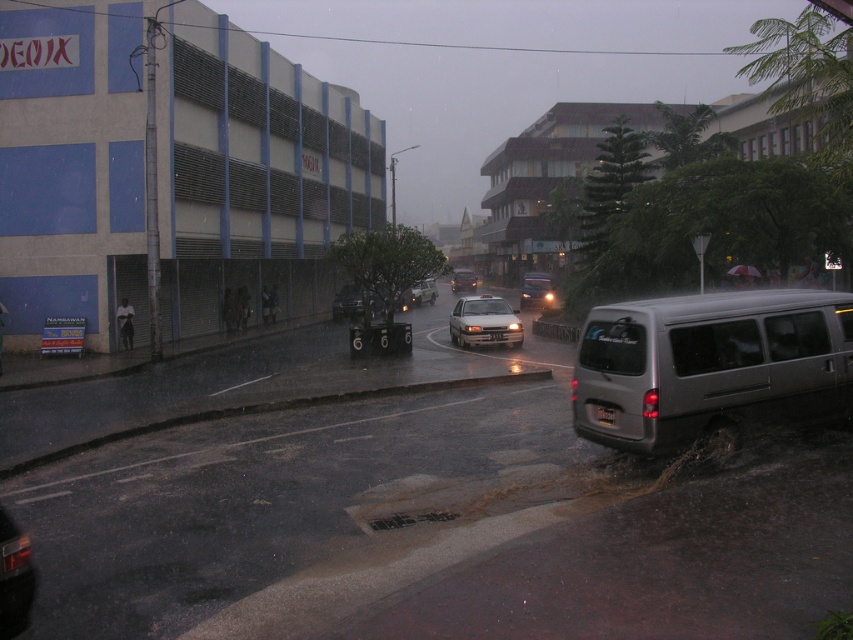
Measure the distance between satin silver van at lower right and camera.

satin silver van at lower right and camera are 8.39 meters apart from each other.

Is satin silver van at lower right wider than metallic silver van at center?

In fact, satin silver van at lower right might be narrower than metallic silver van at center.

Measure the distance between satin silver van at lower right and camera.

satin silver van at lower right is 8.39 meters from camera.

You are a GUI agent. You are given a task and a screenshot of the screen. Output one action in this format:
    pyautogui.click(x=<x>, y=<y>)
    Task: Click on the satin silver van at lower right
    The image size is (853, 640).
    Given the screenshot: What is the action you would take?
    pos(711,364)

What do you see at coordinates (485, 323) in the screenshot?
I see `white matte sedan at center` at bounding box center [485, 323].

Which is in front, point (477, 326) or point (410, 300)?

Point (477, 326) is in front.

Which is behind, point (474, 324) or point (421, 298)?

The point (421, 298) is more distant.

What are the coordinates of `white matte sedan at center` in the screenshot? It's located at (485, 323).

Is shiny silver sedan at center to the left of white glossy taxi at center from the viewer's perspective?

Incorrect, shiny silver sedan at center is not on the left side of white glossy taxi at center.

Is shiny silver sedan at center positioned at the back of white glossy taxi at center?

Yes, it is behind white glossy taxi at center.

Image resolution: width=853 pixels, height=640 pixels. Identify the location of shiny silver sedan at center. (537, 291).